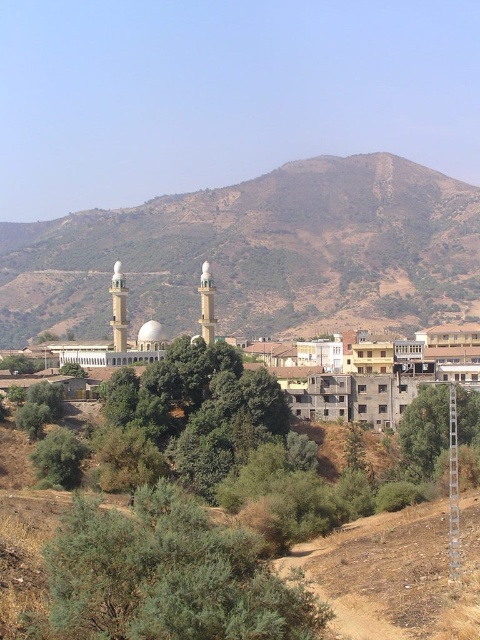
What do you see at coordinates (256, 252) in the screenshot? I see `brown/dry soil hillside at center` at bounding box center [256, 252].

Is brown/dry soil hillside at center above green leafy tree at lower left?

Yes, brown/dry soil hillside at center is above green leafy tree at lower left.

Who is more forward, (217, 294) or (45, 444)?

Point (45, 444) is in front.

I want to click on brown/dry soil hillside at center, so click(x=256, y=252).

Is green leafy bush at lower center thinner than green leafy tree at lower left?

In fact, green leafy bush at lower center might be wider than green leafy tree at lower left.

Does point (160, 564) lie in front of point (83, 458)?

Yes, it is.

At what (x,y) coordinates should I click in order to perform the action: click on green leafy bush at lower center. Please return your answer as a coordinate pair (x, y). This screenshot has width=480, height=640. Looking at the image, I should click on (168, 577).

Which is below, green leafy tree at center or green leafy tree at lower left?

Positioned lower is green leafy tree at lower left.

Which is in front, point (414, 460) or point (51, 467)?

Point (51, 467) is more forward.

Between point (432, 387) and point (62, 438), which one is positioned in front?

Point (62, 438) is more forward.

Locate an element on the screen. This screenshot has height=640, width=480. green leafy tree at center is located at coordinates (423, 432).